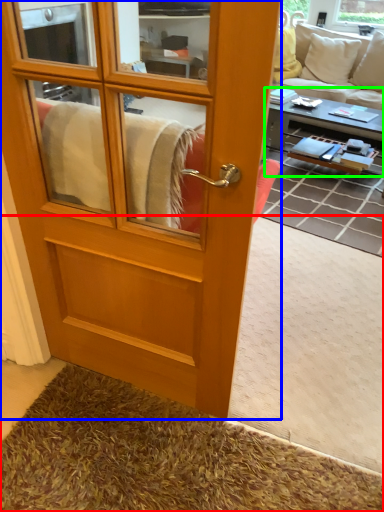
Question: Based on their relative distances, which object is farther from carpets (highlighted by a red box)? Choose from screen door (highlighted by a blue box) and coffee table (highlighted by a green box).

Choices:
 (A) screen door
 (B) coffee table

Answer: (B)